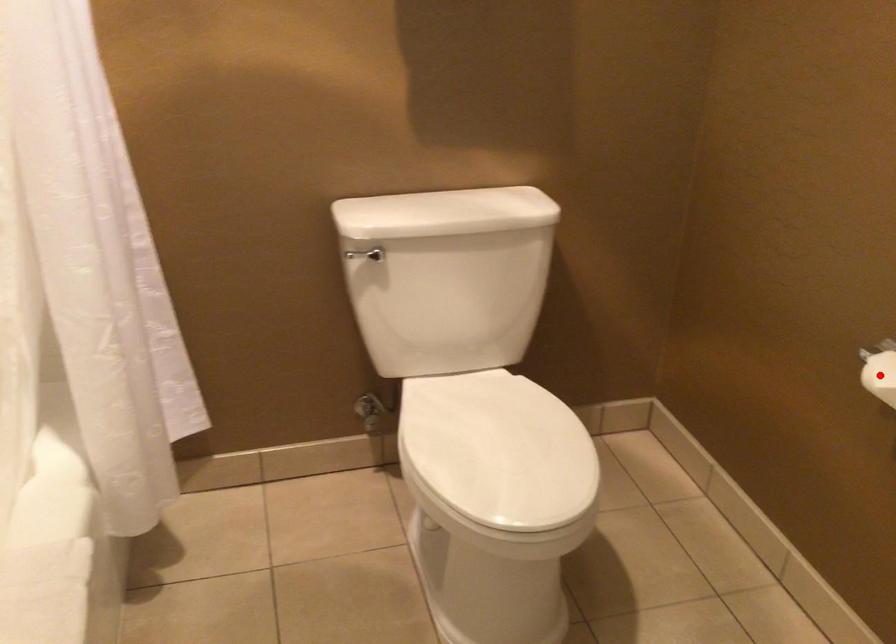
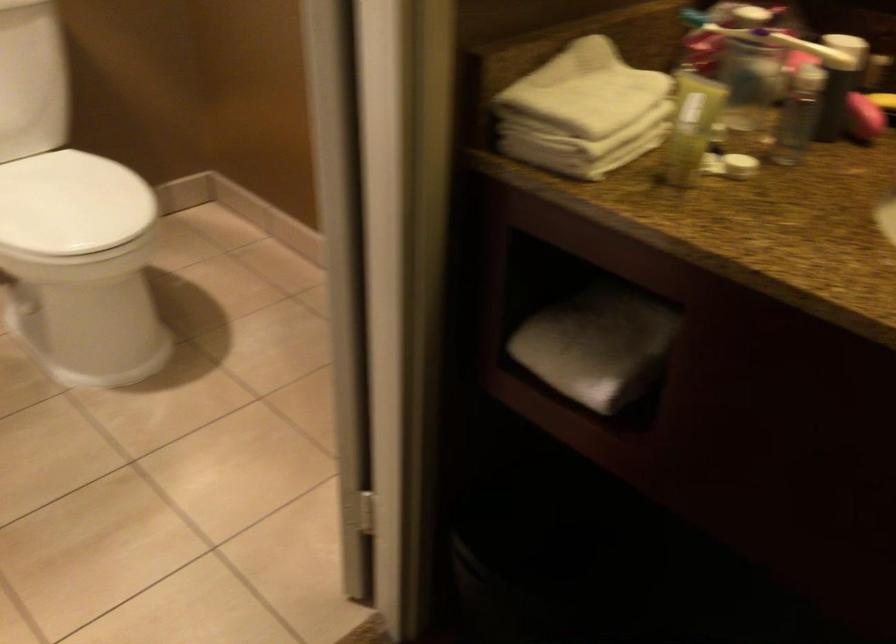
Question: I am providing you with two images of the same scene from different viewpoints. A red point is marked on the first image. Can you still see the location of the red point in image 2?

Choices:
 (A) Yes
 (B) No

Answer: (B)